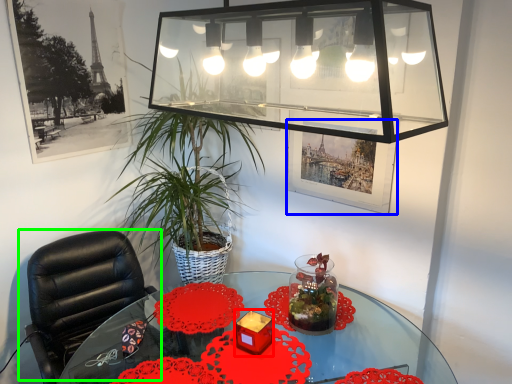
Question: Which is farther away from candle holder (highlighted by a red box)? picture frame (highlighted by a blue box) or chair (highlighted by a green box)?

Choices:
 (A) picture frame
 (B) chair

Answer: (B)